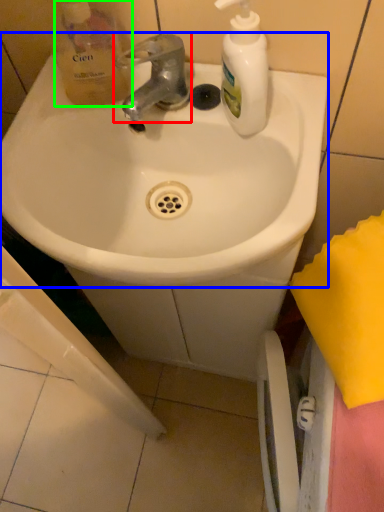
Question: Estimate the real-world distances between objects in this image. Which object is farther from tap (highlighted by a red box), sink (highlighted by a blue box) or product (highlighted by a green box)?

Choices:
 (A) sink
 (B) product

Answer: (A)